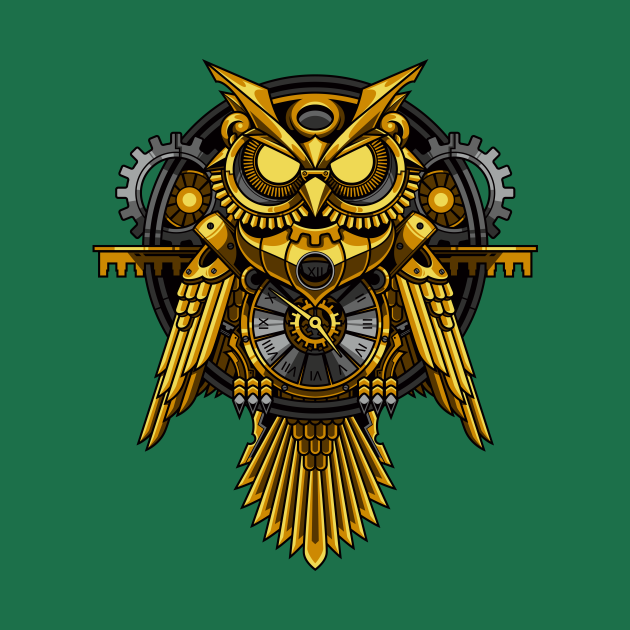
Identify the location of clock hand. (312, 322).